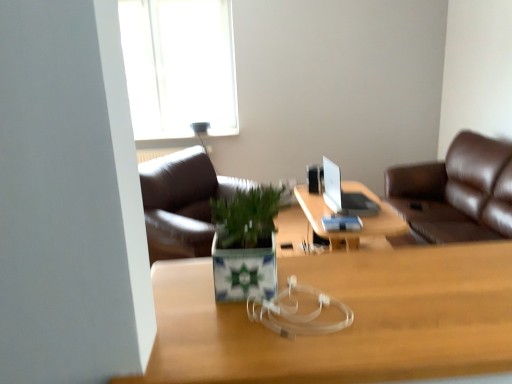
At what (x,y) coordinates should I click in order to perform the action: click on free space that is to the left of silver metallic laptop at center. Please return your answer as a coordinate pair (x, y). The image size is (512, 384). Looking at the image, I should click on (312, 201).